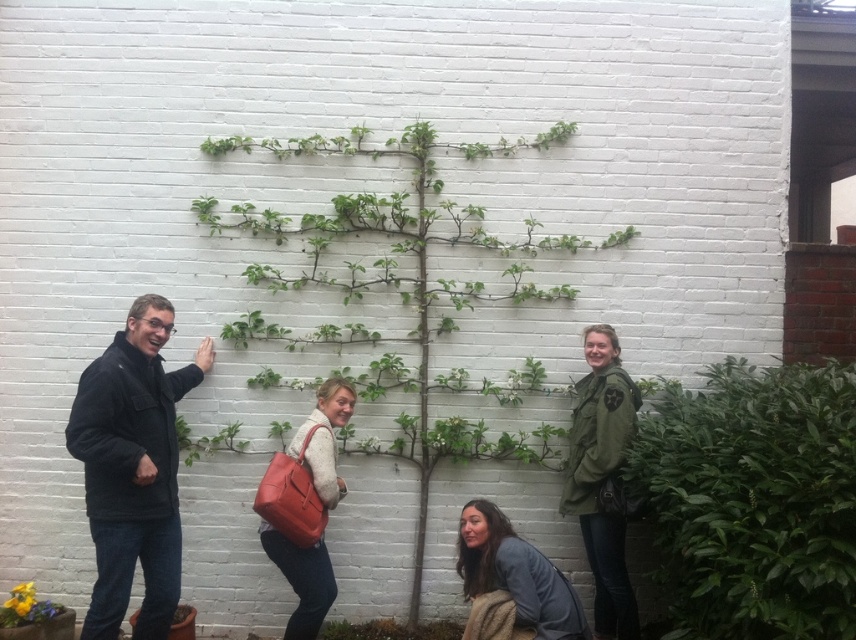
You are standing at the bottom left corner of the image. You want to walk to the point labeled point (x=816, y=416). However, there is an obstacle at point (x=577, y=508). Can you reach your destination without passing through the obstacle?

Yes, because point (x=816, y=416) is in front of point (x=577, y=508), so you can reach it without passing through the obstacle at point (x=577, y=508).

Looking at this image, you are a photographer trying to capture a clear shot of the green leafy bush at right and the green matte jacket at right. Based on their positions, which object is higher up in the frame?

The green leafy bush at right is above the green matte jacket at right, so the green leafy bush at right is higher up in the frame.

Based on the photo, you are trying to take a photo of the dark gray fleece jacket at left but want to ensure the green leafy bush at right doesn t block it. Based on the scene, is the jacket likely to be fully visible without obstruction?

The green leafy bush at right is larger in size than the dark gray fleece jacket at left. Since the bush is bigger, it might partially obscure the jacket depending on their positions. However, the jacket is at the left and the bush at the right, so unless they are very close, the jacket should remain mostly visible. Check their exact placement in the image for final confirmation.